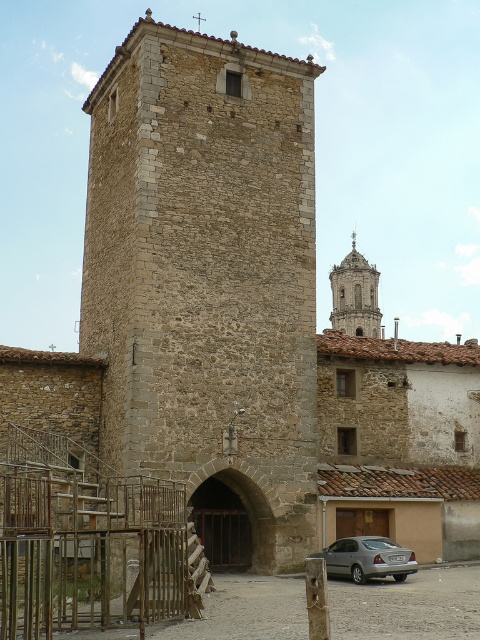
Consider the image. Which of these two, smooth stone bell tower at upper center or brown wooden door at center, stands shorter?

Standing shorter between the two is brown wooden door at center.

Is smooth stone bell tower at upper center to the right of brown wooden door at center from the viewer's perspective?

Correct, you'll find smooth stone bell tower at upper center to the right of brown wooden door at center.

In order to click on smooth stone bell tower at upper center in this screenshot , I will do `click(355, 296)`.

Which is below, brown stone tower at center or smooth stone bell tower at upper center?

brown stone tower at center

Can you confirm if brown stone tower at center is wider than smooth stone bell tower at upper center?

Yes, brown stone tower at center is wider than smooth stone bell tower at upper center.

Which is in front, point (112, 417) or point (360, 316)?

Point (112, 417) is in front.

Identify the location of brown stone tower at center. (206, 280).

Can you confirm if smooth stone bell tower at upper center is taller than satin silver sedan at lower right?

Yes, smooth stone bell tower at upper center is taller than satin silver sedan at lower right.

Can you confirm if smooth stone bell tower at upper center is shorter than satin silver sedan at lower right?

Incorrect, smooth stone bell tower at upper center's height does not fall short of satin silver sedan at lower right's.

Who is more distant from viewer, [345,285] or [348,564]?

The point [345,285] is more distant.

Where is `smooth stone bell tower at upper center`? smooth stone bell tower at upper center is located at coordinates (355, 296).